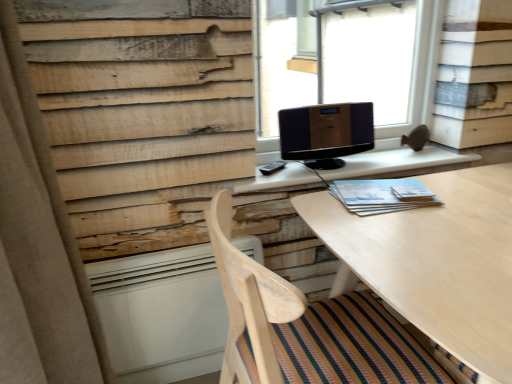
Find the location of a particular element. vacant point above matte wooden table at center (from a real-world perspective) is located at coordinates (369, 156).